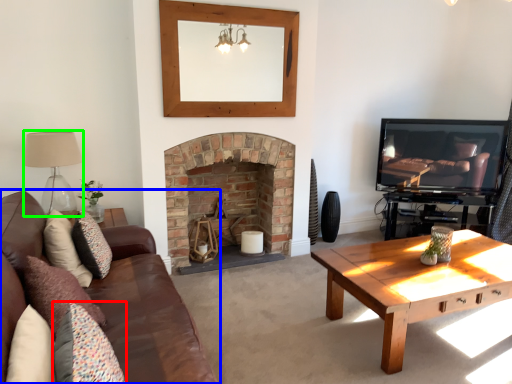
Question: Considering the real-world distances, which object is farthest from pillow (highlighted by a red box)? studio couch (highlighted by a blue box) or lamp (highlighted by a green box)?

Choices:
 (A) studio couch
 (B) lamp

Answer: (B)